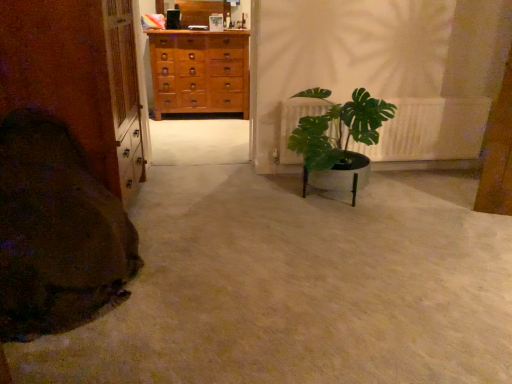
Question: From a real-world perspective, does green leafy plant at center sit lower than light brown wooden chest of drawers at center?

Choices:
 (A) yes
 (B) no

Answer: (A)

Question: Is light brown wooden chest of drawers at center surrounded by green leafy plant at center?

Choices:
 (A) yes
 (B) no

Answer: (B)

Question: Considering the relative positions of green leafy plant at center and light brown wooden chest of drawers at center in the image provided, is green leafy plant at center behind light brown wooden chest of drawers at center?

Choices:
 (A) yes
 (B) no

Answer: (B)

Question: Is green leafy plant at center positioned far away from light brown wooden chest of drawers at center?

Choices:
 (A) no
 (B) yes

Answer: (B)

Question: Is green leafy plant at center located outside light brown wooden chest of drawers at center?

Choices:
 (A) no
 (B) yes

Answer: (B)

Question: Would you say green leafy plant at right is to the left or to the right of brown soft blanket at lower left in the picture?

Choices:
 (A) left
 (B) right

Answer: (B)

Question: Would you say green leafy plant at right is inside or outside brown soft blanket at lower left?

Choices:
 (A) inside
 (B) outside

Answer: (B)

Question: Considering the positions of green leafy plant at right and brown soft blanket at lower left in the image, is green leafy plant at right wider or thinner than brown soft blanket at lower left?

Choices:
 (A) thin
 (B) wide

Answer: (A)

Question: Is green leafy plant at right taller or shorter than brown soft blanket at lower left?

Choices:
 (A) short
 (B) tall

Answer: (A)

Question: In the image, is green leafy plant at center positioned in front of or behind light brown wooden chest of drawers at center?

Choices:
 (A) front
 (B) behind

Answer: (A)

Question: From the image's perspective, relative to light brown wooden chest of drawers at center, is green leafy plant at center above or below?

Choices:
 (A) below
 (B) above

Answer: (A)

Question: Is green leafy plant at center bigger or smaller than light brown wooden chest of drawers at center?

Choices:
 (A) big
 (B) small

Answer: (B)

Question: From their relative heights in the image, would you say green leafy plant at center is taller or shorter than light brown wooden chest of drawers at center?

Choices:
 (A) short
 (B) tall

Answer: (A)

Question: Is brown soft blanket at lower left wider or thinner than light brown wooden chest of drawers at center?

Choices:
 (A) wide
 (B) thin

Answer: (A)

Question: Which is correct: brown soft blanket at lower left is inside light brown wooden chest of drawers at center, or outside of it?

Choices:
 (A) outside
 (B) inside

Answer: (A)